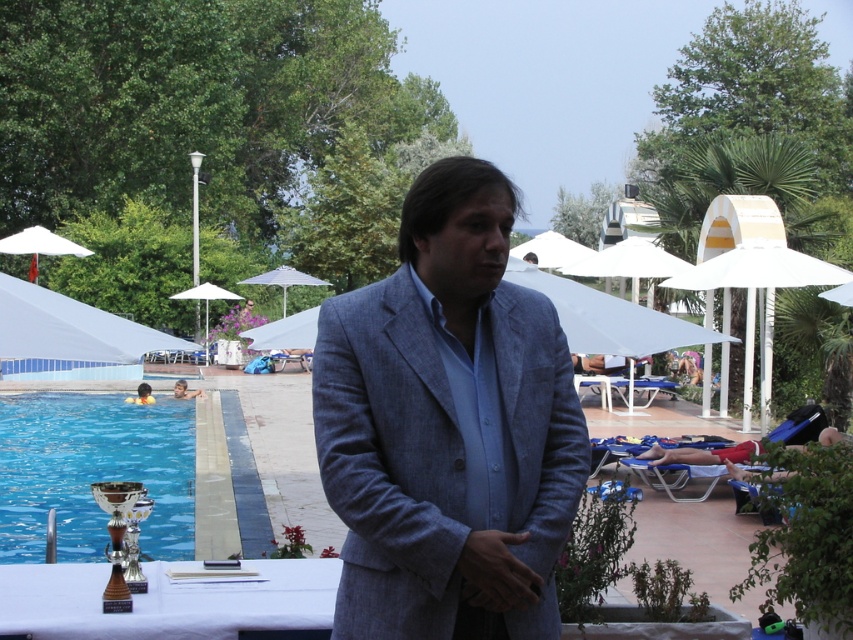
You are a photographer trying to capture a photo of the white fabric umbrella at upper center and the matte gray suit at center. Which object should you focus on first if you want to ensure both are in the frame without moving the camera?

You should focus on the white fabric umbrella at upper center first because it is larger in size than the matte gray suit at center, making it easier to center within the camera frame.

You are a photographer at the event and need to capture both the smooth skin boy at lower left and the matte gray suit at center in a single frame. Given their sizes in the image, which object should you focus on first to ensure both are in the frame?

Since the smooth skin boy at lower left occupies less space than the matte gray suit at center, you should focus on the matte gray suit at center first to ensure both fit within the frame.

You are a photographer standing at the camera position. You need to capture a closeup shot of the blue glass trophy at lower left. Can you reach it without moving your position? The camera has a maximum zoom range of 30 feet.

The blue glass trophy at lower left is 39.83 feet away from camera. Since the camera can only zoom up to 30 feet, you cannot reach it without moving your position.